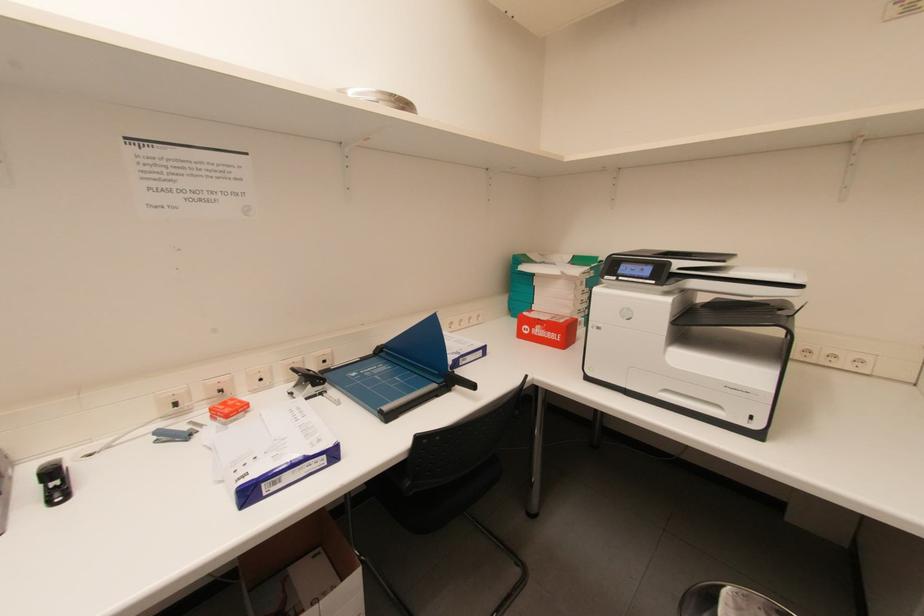
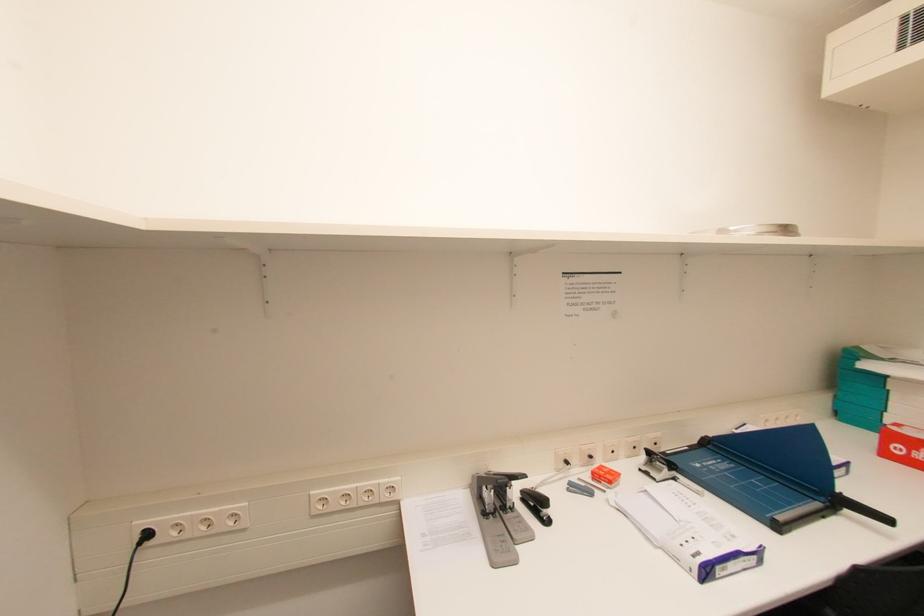
Question: The camera is either moving clockwise (left) or counter-clockwise (right) around the object. The first image is from the beginning of the video and the second image is from the end. Is the camera moving left or right when shooting the video?

Choices:
 (A) Left
 (B) Right

Answer: (B)